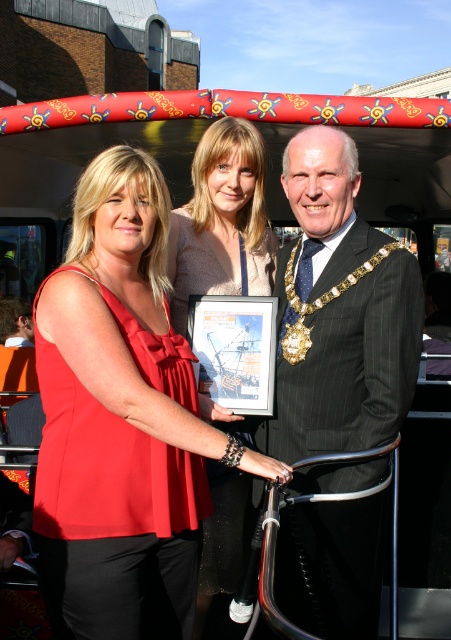
Question: Which object is the farthest from the matte red dress at center?

Choices:
 (A) black pinstripe suit at center
 (B) matte red blouse at center

Answer: (B)

Question: Which point is closer to the camera?

Choices:
 (A) (381, 464)
 (B) (193, 573)
 (C) (231, 477)

Answer: (A)

Question: Is matte red blouse at center below black pinstripe suit at center?

Choices:
 (A) yes
 (B) no

Answer: (A)

Question: Does matte red blouse at center have a larger size compared to matte red dress at center?

Choices:
 (A) yes
 (B) no

Answer: (A)

Question: Can you confirm if matte red blouse at center is smaller than black pinstripe suit at center?

Choices:
 (A) no
 (B) yes

Answer: (B)

Question: Which of these objects is positioned closest to the black pinstripe suit at center?

Choices:
 (A) matte red dress at center
 (B) matte red blouse at center

Answer: (B)